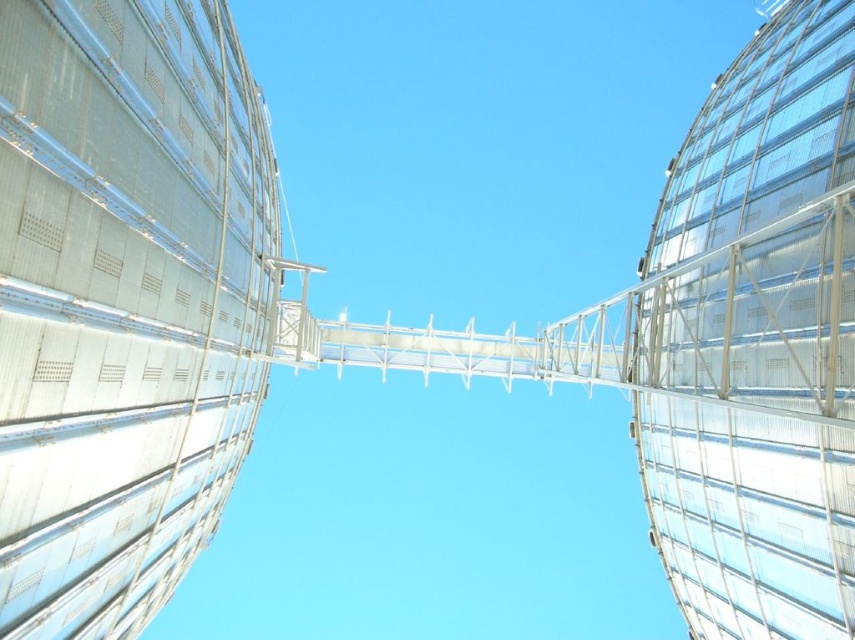
You are an inspector needing to climb the towers to check safety equipment. Given that the metallic silver tower at left is narrower than the transparent glass tower at right, which tower would require more caution when climbing due to its narrower width?

The metallic silver tower at left requires more caution when climbing because it has a smaller size compared to the transparent glass tower at right, making it narrower and potentially less stable.

You are a maintenance worker needing to reach the top of both the metallic silver tower at left and the transparent glass tower at right. Based on the scene, which tower will require you to climb a greater height?

The transparent glass tower at right is taller than the metallic silver tower at left, so you will need to climb a greater height to reach the top of the transparent glass tower at right.

You are a maintenance worker needing to climb the towers. Which tower, the metallic silver tower at left or the transparent glass tower at right, would require you to use a narrower ladder?

The metallic silver tower at left is thinner than the transparent glass tower at right, so you would need to use a narrower ladder for the metallic silver tower at left.